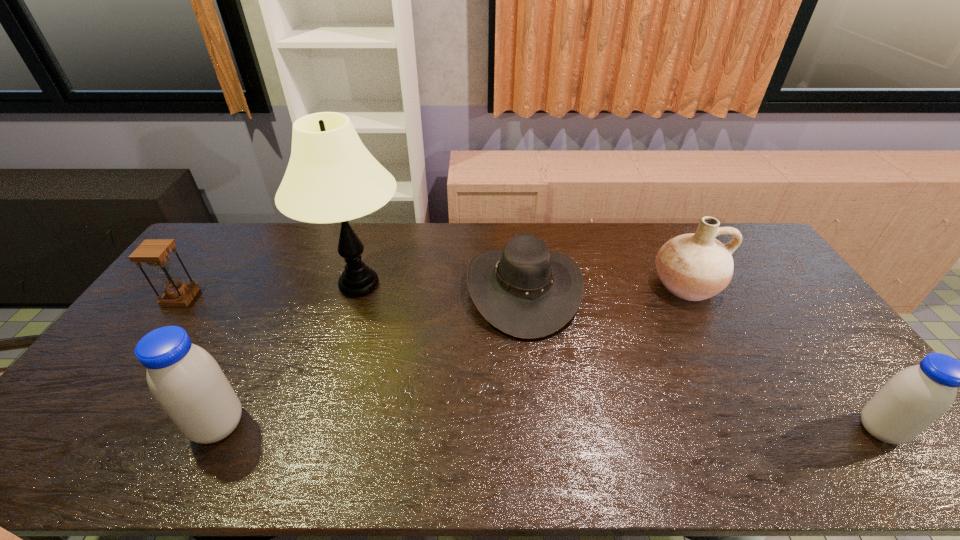
The width and height of the screenshot is (960, 540). In order to click on the second tallest object in this screenshot , I will do `click(186, 381)`.

Locate an element on the screen. the left soya milk is located at coordinates 186,381.

Where is `the shorter soya milk`? The width and height of the screenshot is (960, 540). the shorter soya milk is located at coordinates (914, 398).

Locate an element on the screen. the right soya milk is located at coordinates (914, 398).

At what (x,y) coordinates should I click in order to perform the action: click on the leftmost object. Please return your answer as a coordinate pair (x, y). Looking at the image, I should click on (155, 252).

The height and width of the screenshot is (540, 960). Identify the location of hourglass. (155, 252).

Find the location of a particular element. This screenshot has height=540, width=960. pottery is located at coordinates (696, 266).

At what (x,y) coordinates should I click in order to perform the action: click on the third object from right to left. Please return your answer as a coordinate pair (x, y). The width and height of the screenshot is (960, 540). Looking at the image, I should click on (525, 290).

Find the location of a particular element. This screenshot has width=960, height=540. cowboy hat is located at coordinates (525, 290).

Image resolution: width=960 pixels, height=540 pixels. I want to click on the fourth object from right to left, so click(x=331, y=177).